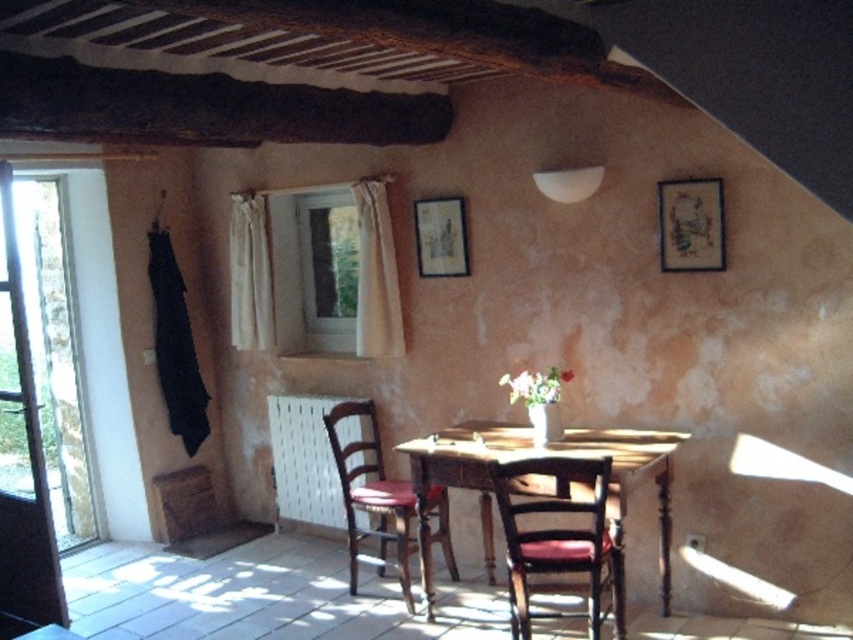
Is wooden chair with red cushion at center further to camera compared to wooden picture frame at upper center?

No, it is not.

Is point (350, 556) in front of point (456, 264)?

Yes, point (350, 556) is in front of point (456, 264).

Which is behind, point (410, 492) or point (454, 212)?

Positioned behind is point (454, 212).

This screenshot has width=853, height=640. In order to click on wooden chair with red cushion at center in this screenshot , I will do `click(370, 497)`.

Which is behind, point (589, 467) or point (409, 608)?

Point (409, 608)

Between wooden chair with cushion at center and wooden chair with red cushion at center, which one appears on the left side from the viewer's perspective?

From the viewer's perspective, wooden chair with red cushion at center appears more on the left side.

Who is more distant from viewer, (508, 545) or (363, 410)?

The point (363, 410) is behind.

The image size is (853, 640). In order to click on wooden chair with cushion at center in this screenshot , I will do coord(556,538).

Is point (637, 483) behind point (590, 548)?

Yes, point (637, 483) is behind point (590, 548).

In the scene shown: Can you confirm if wooden table at center is thinner than wooden chair with cushion at center?

No, wooden table at center is not thinner than wooden chair with cushion at center.

Is point (490, 486) behind point (511, 589)?

That is True.

The height and width of the screenshot is (640, 853). Find the location of `wooden table at center`. wooden table at center is located at coordinates (544, 452).